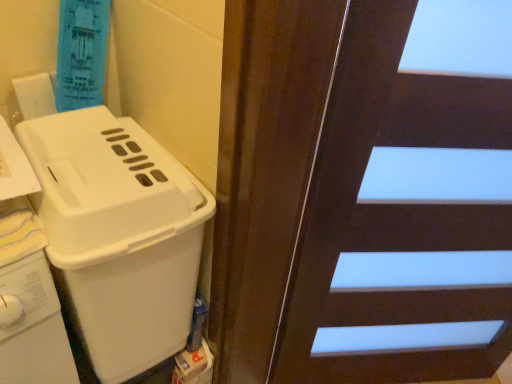
Question: Is the position of white plastic basket at left more distant than that of dark wood door at upper right?

Choices:
 (A) yes
 (B) no

Answer: (A)

Question: Is white plastic basket at left shorter than dark wood door at upper right?

Choices:
 (A) no
 (B) yes

Answer: (B)

Question: Considering the relative positions of white plastic basket at left and dark wood door at upper right in the image provided, is white plastic basket at left in front of dark wood door at upper right?

Choices:
 (A) yes
 (B) no

Answer: (B)

Question: Can you confirm if white plastic basket at left is positioned to the left of dark wood door at upper right?

Choices:
 (A) no
 (B) yes

Answer: (B)

Question: Is white plastic basket at left facing away from dark wood door at upper right?

Choices:
 (A) no
 (B) yes

Answer: (A)

Question: From a real-world perspective, is white plastic basket at left under dark wood door at upper right?

Choices:
 (A) no
 (B) yes

Answer: (B)

Question: Is dark wood door at upper right far from white plastic basket at left?

Choices:
 (A) yes
 (B) no

Answer: (B)

Question: Is dark wood door at upper right to the left of white plastic basket at left from the viewer's perspective?

Choices:
 (A) no
 (B) yes

Answer: (A)

Question: Is dark wood door at upper right facing away from white plastic basket at left?

Choices:
 (A) yes
 (B) no

Answer: (B)

Question: From the image's perspective, is dark wood door at upper right on top of white plastic basket at left?

Choices:
 (A) yes
 (B) no

Answer: (B)

Question: Is dark wood door at upper right further to the viewer compared to white plastic basket at left?

Choices:
 (A) no
 (B) yes

Answer: (A)

Question: Is white plastic basket at left completely or partially inside dark wood door at upper right?

Choices:
 (A) yes
 (B) no

Answer: (B)

Question: Does point (166, 279) appear closer or farther from the camera than point (501, 235)?

Choices:
 (A) closer
 (B) farther

Answer: (A)